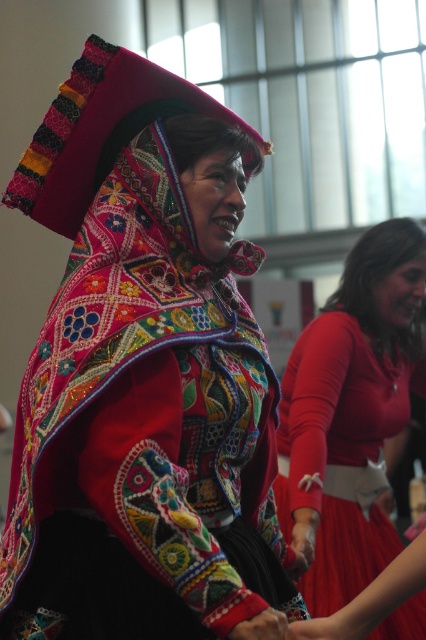
Looking at this image, is embroidered fabric shawl at center bigger than matte red dress at center?

No.

Between embroidered fabric shawl at center and matte red dress at center, which one is positioned higher?

embroidered fabric shawl at center

Which is in front, point (149, 460) or point (414, 632)?

Positioned in front is point (149, 460).

Where is `embroidered fabric shawl at center`? embroidered fabric shawl at center is located at coordinates (144, 376).